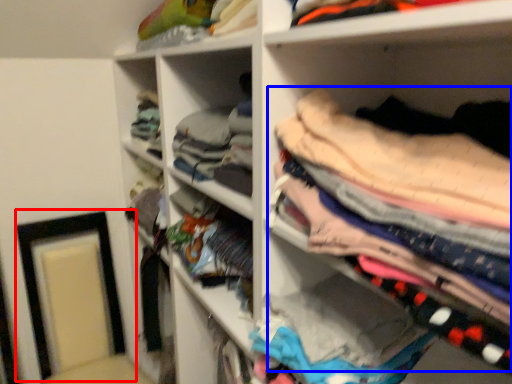
Question: Which object is closer to the camera taking this photo, picture frame (highlighted by a red box) or clothing (highlighted by a blue box)?

Choices:
 (A) picture frame
 (B) clothing

Answer: (B)